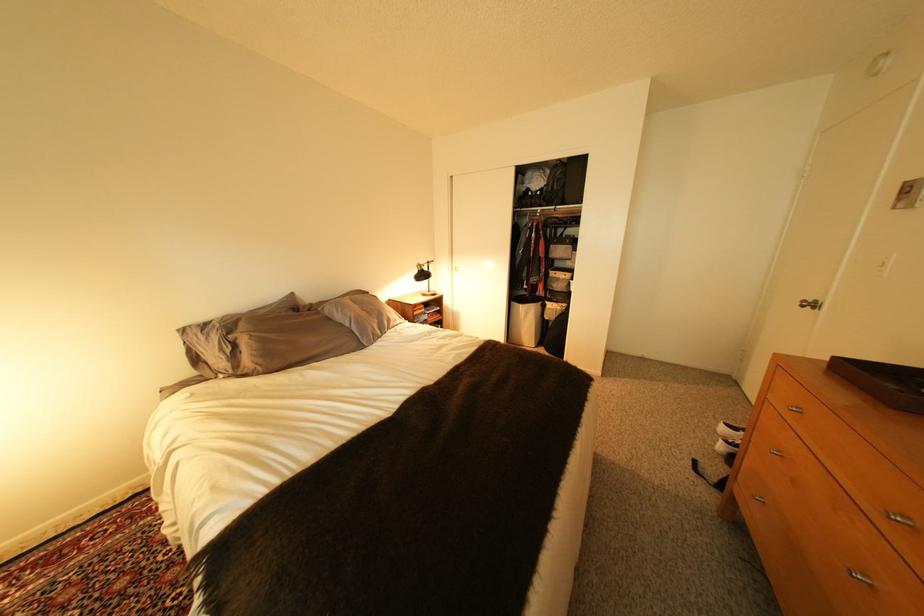
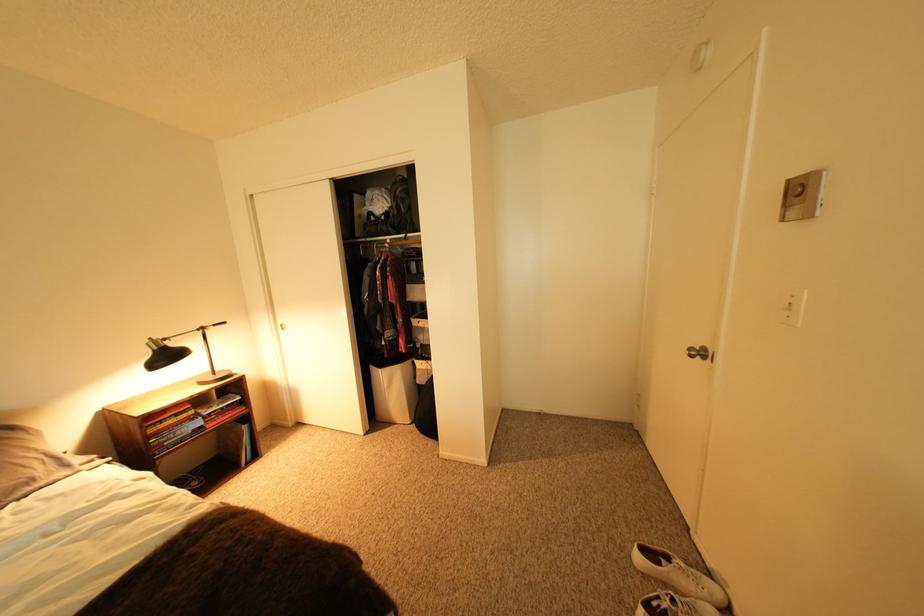
In the second image, find the point that corresponds to point 432,270 in the first image.

(168, 350)